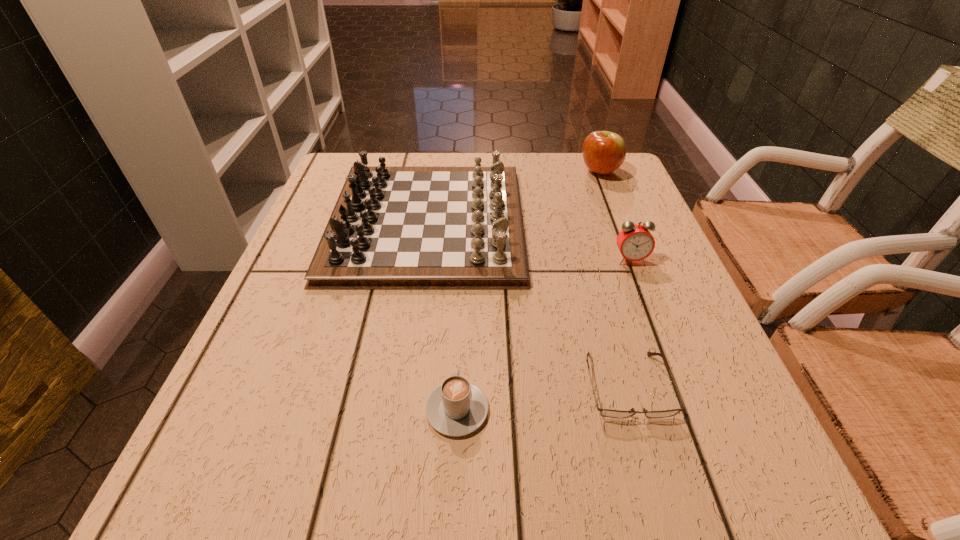
Identify the location of empty space between the third tallest object and the chessboard. (529, 241).

At what (x,y) coordinates should I click in order to perform the action: click on vacant space that's between the chessboard and the alarm clock. Please return your answer as a coordinate pair (x, y). Looking at the image, I should click on (529, 241).

I want to click on free space between the spectacles and the cappuccino, so click(542, 397).

You are a GUI agent. You are given a task and a screenshot of the screen. Output one action in this format:
    pyautogui.click(x=<x>, y=<y>)
    Task: Click on the vacant region between the spectacles and the apple
    This screenshot has width=960, height=540.
    Given the screenshot: What is the action you would take?
    pyautogui.click(x=613, y=279)

Locate an element on the screen. The height and width of the screenshot is (540, 960). vacant area that lies between the apple and the spectacles is located at coordinates (613, 279).

The height and width of the screenshot is (540, 960). I want to click on object that stands as the third closest to the spectacles, so click(x=635, y=242).

Identify which object is the nearest to the second shortest object. Please provide its 2D coordinates. Your answer should be formatted as a tuple, i.e. [(x, y)], where the tuple contains the x and y coordinates of a point satisfying the conditions above.

[(609, 413)]

Where is `vacant space that satisfies the following two spatial constraints: 1. to the right of the second shortest object; 2. from the player's perspective of the chessboard`? This screenshot has width=960, height=540. vacant space that satisfies the following two spatial constraints: 1. to the right of the second shortest object; 2. from the player's perspective of the chessboard is located at coordinates (465, 222).

Locate an element on the screen. The width and height of the screenshot is (960, 540). vacant area that satisfies the following two spatial constraints: 1. to the right of the cappuccino; 2. on the right side of the apple is located at coordinates (468, 172).

What are the coordinates of `vacant position in the image that satisfies the following two spatial constraints: 1. to the right of the cappuccino; 2. from the player's perspective of the chessboard` in the screenshot? It's located at (465, 222).